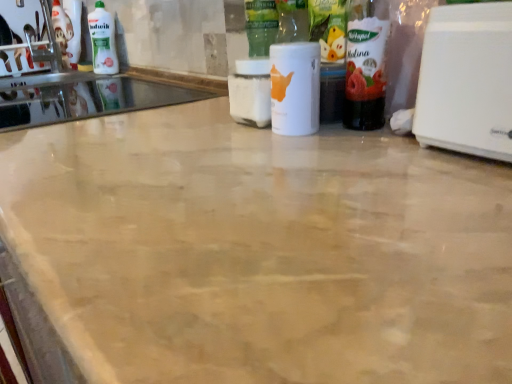
Identify the location of white matte bottle at center, the 2th bottle when ordered from right to left. The width and height of the screenshot is (512, 384). (294, 73).

In order to face white glossy bottle at upper left, should I rotate leftwards or rightwards?

Turn left by 20.057 degrees to look at white glossy bottle at upper left.

Identify the location of translucent plastic bottle at right, which is the second bottle from left to right. (365, 64).

From a real-world perspective, does white matte bottle at center, the 2th bottle when ordered from right to left, sit lower than white plastic toaster at right?

Indeed, from a real-world perspective, white matte bottle at center, the 2th bottle when ordered from right to left, is positioned beneath white plastic toaster at right.

Does white matte bottle at center, the 2th bottle when ordered from right to left, touch white plastic toaster at right?

No, white matte bottle at center, the 2th bottle when ordered from right to left, is not beside white plastic toaster at right.

Can you confirm if white matte bottle at center, the first bottle viewed from the left, is wider than white plastic toaster at right?

No, white matte bottle at center, the first bottle viewed from the left, is not wider than white plastic toaster at right.

Does translucent plastic bottle at right, which appears as the 1th bottle when viewed from the right, touch white glossy sink at upper left?

No.

Which object is further away from the camera, translucent plastic bottle at right, which is the second bottle from left to right, or white glossy sink at upper left?

white glossy sink at upper left.

Which of these two, translucent plastic bottle at right, which is the second bottle from left to right, or white glossy sink at upper left, is smaller?

With smaller size is translucent plastic bottle at right, which is the second bottle from left to right.

Does translucent plastic bottle at right, which is the second bottle from left to right, appear on the left side of white glossy sink at upper left?

In fact, translucent plastic bottle at right, which is the second bottle from left to right, is to the right of white glossy sink at upper left.

Is translucent plastic bottle at right, which appears as the 1th bottle when viewed from the right, positioned with its back to white matte bottle at center, the 2th bottle when ordered from right to left?

That's not correct — translucent plastic bottle at right, which appears as the 1th bottle when viewed from the right, is not looking away from white matte bottle at center, the 2th bottle when ordered from right to left.

Who is shorter, translucent plastic bottle at right, which appears as the 1th bottle when viewed from the right, or white matte bottle at center, the first bottle viewed from the left?

Standing shorter between the two is white matte bottle at center, the first bottle viewed from the left.

Between point (384, 1) and point (316, 42), which one is positioned in front?

Positioned in front is point (384, 1).

Considering the positions of objects translucent plastic bottle at right, which is the second bottle from left to right, and white matte bottle at center, the 2th bottle when ordered from right to left, in the image provided, who is more to the left, translucent plastic bottle at right, which is the second bottle from left to right, or white matte bottle at center, the 2th bottle when ordered from right to left,?

From the viewer's perspective, white matte bottle at center, the 2th bottle when ordered from right to left, appears more on the left side.

Is white matte bottle at center, the first bottle viewed from the left, surrounded by white glossy bottle at upper left?

That's incorrect, white matte bottle at center, the first bottle viewed from the left, is not inside white glossy bottle at upper left.

Does white glossy bottle at upper left have a greater height compared to white matte bottle at center, the 2th bottle when ordered from right to left?

Yes, white glossy bottle at upper left is taller than white matte bottle at center, the 2th bottle when ordered from right to left.

From a real-world perspective, is white glossy bottle at upper left on top of white matte bottle at center, the first bottle viewed from the left?

Yes, from a real-world perspective, white glossy bottle at upper left is above white matte bottle at center, the first bottle viewed from the left.

Does white glossy bottle at upper left turn towards white plastic toaster at right?

No, white glossy bottle at upper left is not aimed at white plastic toaster at right.

From the image's perspective, which is above, white glossy bottle at upper left or white plastic toaster at right?

white glossy bottle at upper left.

Would you say white glossy bottle at upper left contains white plastic toaster at right?

Actually, white plastic toaster at right is outside white glossy bottle at upper left.

Considering their positions, is white glossy bottle at upper left located in front of or behind white plastic toaster at right?

Clearly, white glossy bottle at upper left is behind white plastic toaster at right.

Would you say white plastic toaster at right is a long distance from white glossy sink at upper left?

white plastic toaster at right is actually quite close to white glossy sink at upper left.

Measure the distance between white plastic toaster at right and white glossy sink at upper left.

They are 34.39 inches apart.

Where is `home appliance above the white glossy sink at upper left (from a real-world perspective)`? The width and height of the screenshot is (512, 384). home appliance above the white glossy sink at upper left (from a real-world perspective) is located at coordinates (467, 81).

Is white plastic toaster at right turned away from white glossy sink at upper left?

No.

From a real-world perspective, is white glossy sink at upper left under white matte bottle at center, the first bottle viewed from the left?

Yes, from a real-world perspective, white glossy sink at upper left is below white matte bottle at center, the first bottle viewed from the left.

Does white glossy sink at upper left come behind white matte bottle at center, the 2th bottle when ordered from right to left?

Yes, it is behind white matte bottle at center, the 2th bottle when ordered from right to left.

Which is in front, point (104, 101) or point (283, 115)?

The point (283, 115) is closer.

The image size is (512, 384). I want to click on home appliance lying in front of the white matte bottle at center, the 2th bottle when ordered from right to left, so click(x=467, y=81).

This screenshot has height=384, width=512. In the image, there is a translucent plastic bottle at right, which is the second bottle from left to right. What are the coordinates of `sink below it (from a real-world perspective)` in the screenshot? It's located at (83, 97).

From the picture: Estimate the real-world distances between objects in this image. Which object is closer to white plastic toaster at right, white matte bottle at center, the first bottle viewed from the left, or white glossy sink at upper left?

Based on the image, white matte bottle at center, the first bottle viewed from the left, appears to be nearer to white plastic toaster at right.

Looking at the image, which one is located closer to white glossy bottle at upper left, white glossy sink at upper left or white matte bottle at center, the first bottle viewed from the left?

The object closer to white glossy bottle at upper left is white glossy sink at upper left.

When comparing their distances from translucent plastic bottle at right, which appears as the 1th bottle when viewed from the right, does white glossy bottle at upper left or white glossy sink at upper left seem further?

white glossy bottle at upper left is positioned further to the anchor translucent plastic bottle at right, which appears as the 1th bottle when viewed from the right.

Considering their positions, is white matte bottle at center, the 2th bottle when ordered from right to left, positioned closer to white glossy sink at upper left than translucent plastic bottle at right, which is the second bottle from left to right?

The object closer to white glossy sink at upper left is white matte bottle at center, the 2th bottle when ordered from right to left.

Based on their spatial positions, is white glossy sink at upper left or translucent plastic bottle at right, which is the second bottle from left to right, further from white matte bottle at center, the first bottle viewed from the left?

white glossy sink at upper left is positioned further to the anchor white matte bottle at center, the first bottle viewed from the left.

Looking at the image, which one is located closer to white plastic toaster at right, white glossy bottle at upper left or white matte bottle at center, the 2th bottle when ordered from right to left?

white matte bottle at center, the 2th bottle when ordered from right to left, lies closer to white plastic toaster at right than the other object.

Looking at the image, which one is located closer to white plastic toaster at right, white matte bottle at center, the 2th bottle when ordered from right to left, or translucent plastic bottle at right, which is the second bottle from left to right?

translucent plastic bottle at right, which is the second bottle from left to right, is positioned closer to the anchor white plastic toaster at right.

Looking at the image, which one is located closer to white matte bottle at center, the first bottle viewed from the left, translucent plastic bottle at right, which appears as the 1th bottle when viewed from the right, or white glossy sink at upper left?

translucent plastic bottle at right, which appears as the 1th bottle when viewed from the right.

Where is `bottle between white glossy sink at upper left and translucent plastic bottle at right, which appears as the 1th bottle when viewed from the right, from left to right`? The height and width of the screenshot is (384, 512). bottle between white glossy sink at upper left and translucent plastic bottle at right, which appears as the 1th bottle when viewed from the right, from left to right is located at coordinates (294, 73).

The height and width of the screenshot is (384, 512). Identify the location of sink between white plastic toaster at right and white glossy bottle at upper left in the front-back direction. (83, 97).

Find the location of a particular element. This screenshot has height=384, width=512. sink located between white matte bottle at center, the first bottle viewed from the left, and white glossy bottle at upper left in the depth direction is located at coordinates (83, 97).

Find the location of a particular element. bottle between white plastic toaster at right and white matte bottle at center, the first bottle viewed from the left, along the z-axis is located at coordinates (365, 64).